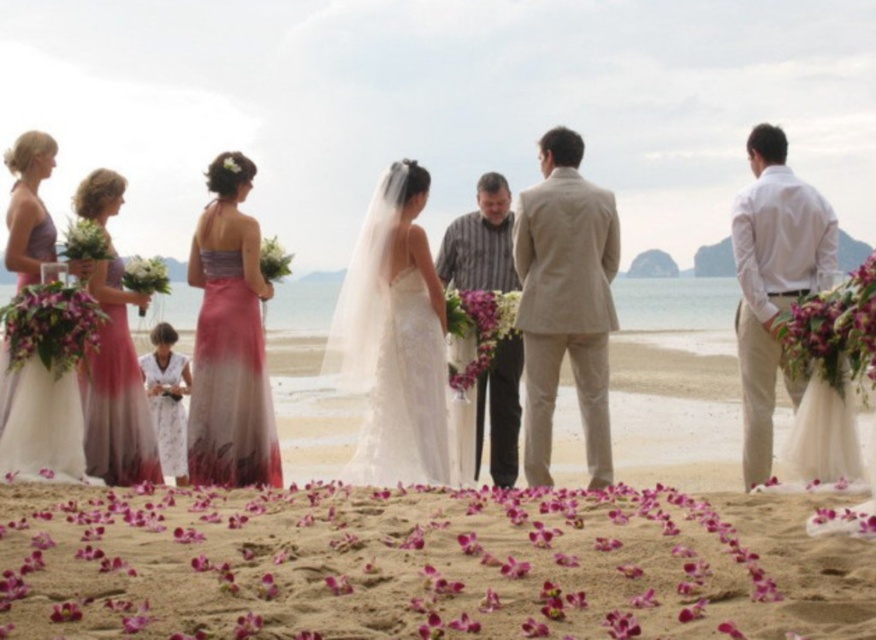
Question: Estimate the real-world distances between objects in this image. Which object is farther from the white floral dress at lower left?

Choices:
 (A) white lace dress at center
 (B) matte pink dress at left

Answer: (B)

Question: Is matte pink dress at left wider than purple satin dress at left?

Choices:
 (A) no
 (B) yes

Answer: (B)

Question: Which object is the closest to the purple floral bouquet at right?

Choices:
 (A) white lace dress at center
 (B) pink satin dress at left
 (C) purple silk flower at center
 (D) purple satin dress at left

Answer: (C)

Question: Is matte pink dress at left behind purple satin dress at left?

Choices:
 (A) no
 (B) yes

Answer: (A)

Question: Which of the following is the farthest from the observer?

Choices:
 (A) pink fabric petals at center
 (B) white cotton shirt at right
 (C) white silk flower at upper center

Answer: (C)

Question: Can you confirm if striped cotton shirt at center is positioned to the left of purple silk bouquet at left?

Choices:
 (A) yes
 (B) no

Answer: (B)